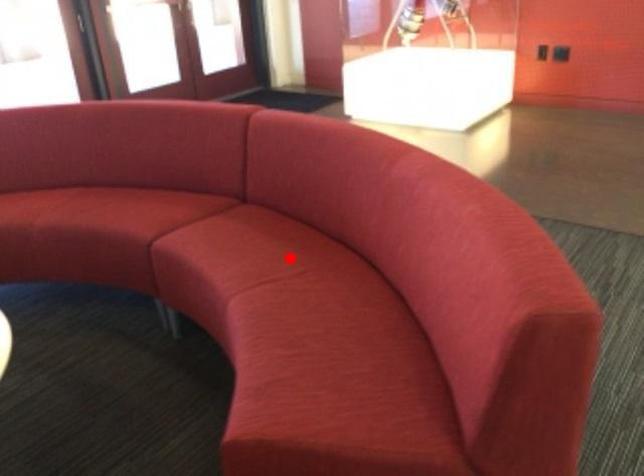
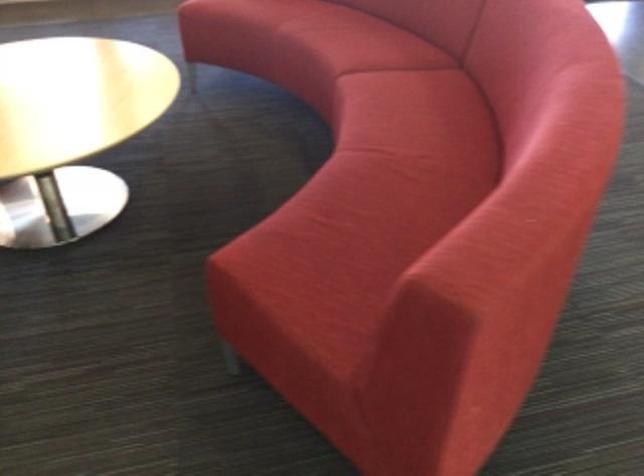
Question: I am providing you with two images of the same scene from different viewpoints. A red point is marked on the first image. At the location where the point appears in image 1, is it still visible in image 2?

Choices:
 (A) Yes
 (B) No

Answer: (A)